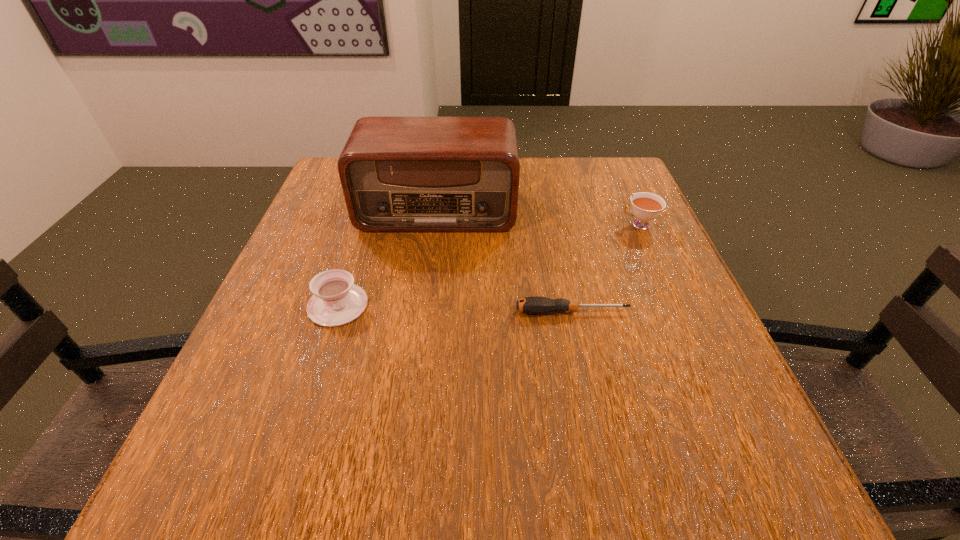
I want to click on free space between the radio receiver and the left teacup, so click(388, 258).

This screenshot has width=960, height=540. Find the location of `empty space between the radio receiver and the left teacup`. empty space between the radio receiver and the left teacup is located at coordinates (388, 258).

Locate which object ranks third in proximity to the screwdriver. Please provide its 2D coordinates. Your answer should be formatted as a tuple, i.e. [(x, y)], where the tuple contains the x and y coordinates of a point satisfying the conditions above.

[(336, 301)]

Select which object appears as the closest to the tallest object. Please provide its 2D coordinates. Your answer should be formatted as a tuple, i.e. [(x, y)], where the tuple contains the x and y coordinates of a point satisfying the conditions above.

[(336, 301)]

Locate an element on the screen. The height and width of the screenshot is (540, 960). vacant space that satisfies the following two spatial constraints: 1. on the front panel of the radio receiver; 2. on the handle side of the nearer teacup is located at coordinates (425, 305).

Locate an element on the screen. free space that satisfies the following two spatial constraints: 1. on the back side of the shortest object; 2. on the handle side of the left teacup is located at coordinates (571, 305).

Locate an element on the screen. The height and width of the screenshot is (540, 960). vacant area in the image that satisfies the following two spatial constraints: 1. on the front panel of the tallest object; 2. on the handle side of the left teacup is located at coordinates (425, 305).

At what (x,y) coordinates should I click in order to perform the action: click on free space that satisfies the following two spatial constraints: 1. on the front panel of the radio receiver; 2. on the right side of the shortest object. Please return your answer as a coordinate pair (x, y). Looking at the image, I should click on (424, 312).

This screenshot has width=960, height=540. I want to click on free location that satisfies the following two spatial constraints: 1. on the front panel of the tallest object; 2. on the right side of the shortest object, so click(424, 312).

The image size is (960, 540). I want to click on free space that satisfies the following two spatial constraints: 1. on the handle side of the left teacup; 2. on the back side of the screwdriver, so click(336, 312).